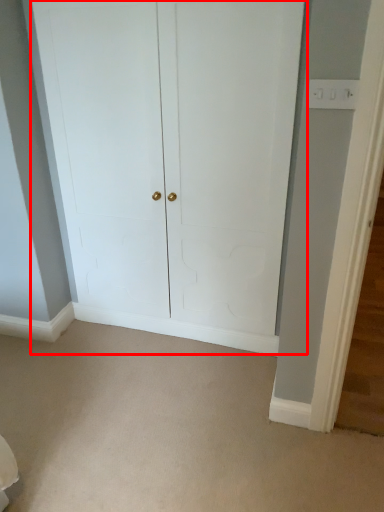
Question: Where is door (annotated by the red box) located in relation to plain in the image?

Choices:
 (A) left
 (B) right

Answer: (B)